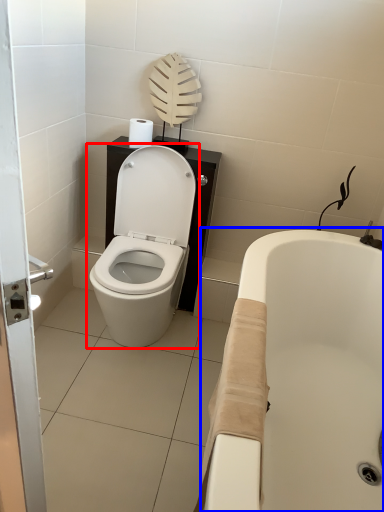
Question: Which object is closer to the camera taking this photo, toilet (highlighted by a red box) or bath (highlighted by a blue box)?

Choices:
 (A) toilet
 (B) bath

Answer: (B)